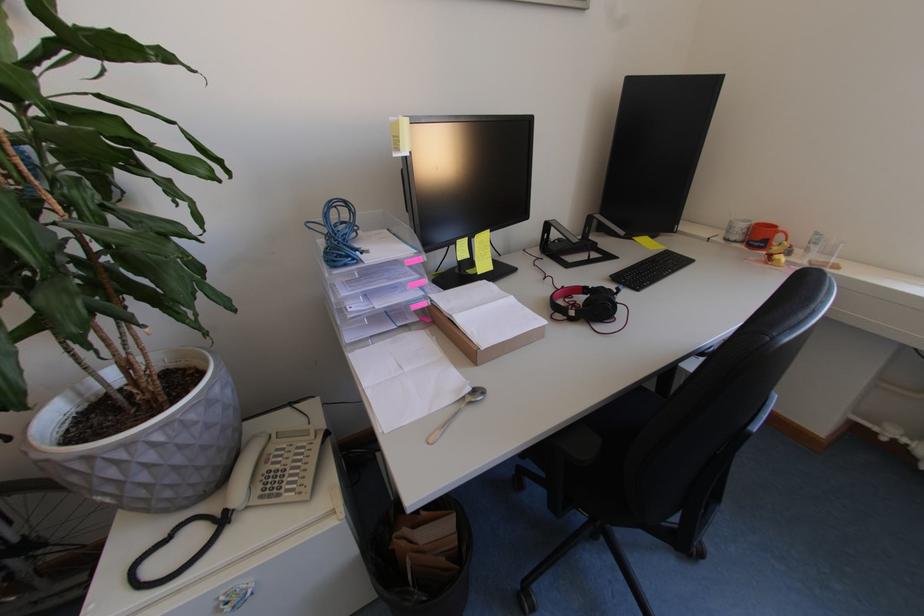
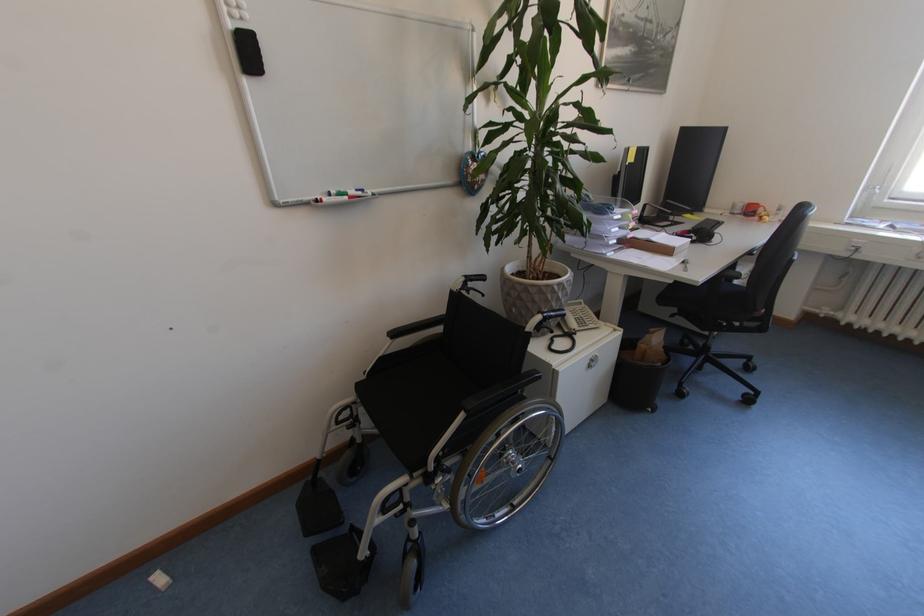
What movement of the cameraman would produce the second image?

The cameraman walked toward left, backward.